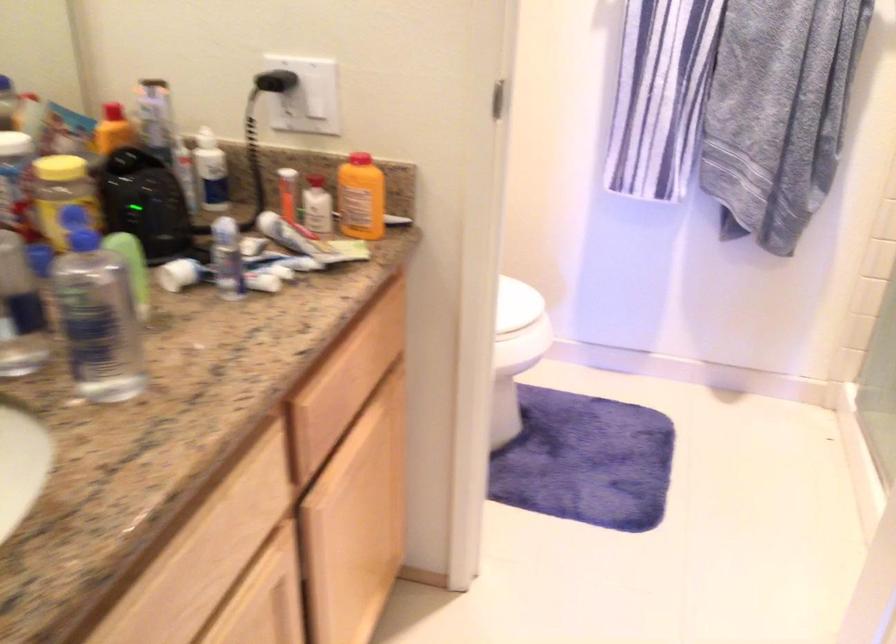
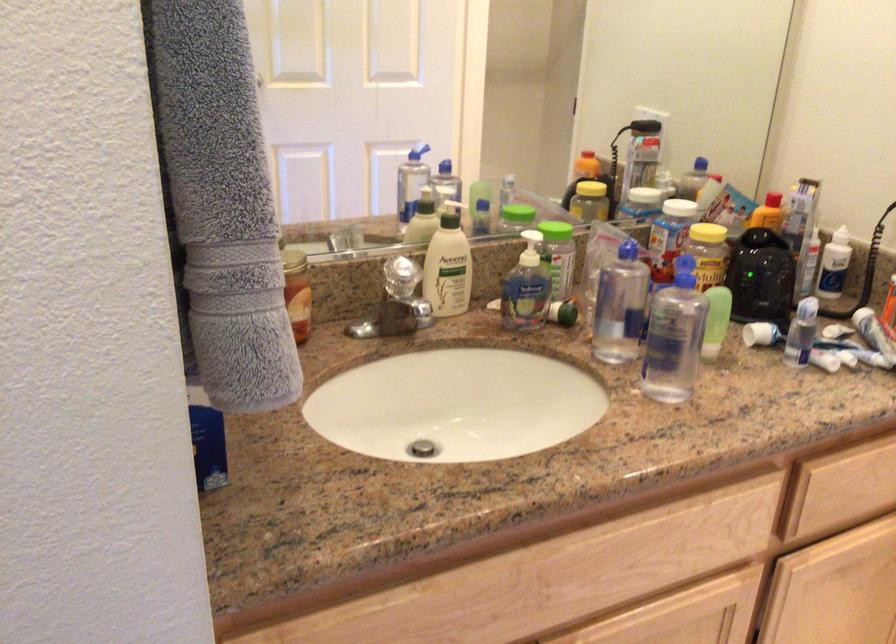
Locate, in the second image, the point that corresponds to (73,172) in the first image.

(707, 232)